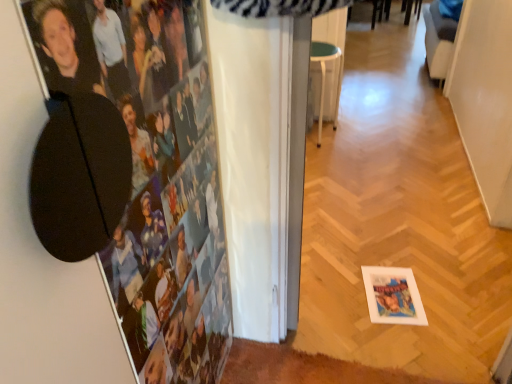
Question: From the image's perspective, is fabric swivel chair at upper right under black matte photo frame at upper left?

Choices:
 (A) no
 (B) yes

Answer: (A)

Question: Does fabric swivel chair at upper right lie in front of black matte photo frame at upper left?

Choices:
 (A) yes
 (B) no

Answer: (B)

Question: Does fabric swivel chair at upper right have a greater height compared to black matte photo frame at upper left?

Choices:
 (A) yes
 (B) no

Answer: (B)

Question: Can you confirm if fabric swivel chair at upper right is wider than black matte photo frame at upper left?

Choices:
 (A) no
 (B) yes

Answer: (B)

Question: Is fabric swivel chair at upper right surrounding black matte photo frame at upper left?

Choices:
 (A) yes
 (B) no

Answer: (B)

Question: In terms of height, does black matte photo frame at upper left look taller or shorter compared to fabric swivel chair at upper right?

Choices:
 (A) short
 (B) tall

Answer: (B)

Question: Would you say black matte photo frame at upper left is to the left or to the right of fabric swivel chair at upper right in the picture?

Choices:
 (A) right
 (B) left

Answer: (B)

Question: Does point (170, 256) appear closer or farther from the camera than point (454, 36)?

Choices:
 (A) closer
 (B) farther

Answer: (A)

Question: Looking at the image, does black matte photo frame at upper left seem bigger or smaller compared to fabric swivel chair at upper right?

Choices:
 (A) big
 (B) small

Answer: (B)

Question: In the image, is fabric swivel chair at upper right positioned in front of or behind white plastic stool at center?

Choices:
 (A) behind
 (B) front

Answer: (A)

Question: Based on their positions, is fabric swivel chair at upper right located to the left or right of white plastic stool at center?

Choices:
 (A) left
 (B) right

Answer: (B)

Question: Does point (428, 64) appear closer or farther from the camera than point (323, 100)?

Choices:
 (A) closer
 (B) farther

Answer: (B)

Question: Do you think fabric swivel chair at upper right is within white plastic stool at center, or outside of it?

Choices:
 (A) inside
 (B) outside

Answer: (B)

Question: Is white plastic stool at center wider or thinner than fabric swivel chair at upper right?

Choices:
 (A) thin
 (B) wide

Answer: (B)

Question: Considering the positions of white plastic stool at center and fabric swivel chair at upper right in the image, is white plastic stool at center taller or shorter than fabric swivel chair at upper right?

Choices:
 (A) short
 (B) tall

Answer: (A)